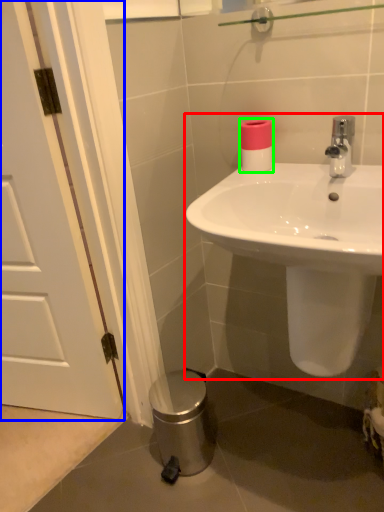
Question: Which is farther away from sink (highlighted by a red box)? door (highlighted by a blue box) or toilet paper (highlighted by a green box)?

Choices:
 (A) door
 (B) toilet paper

Answer: (A)